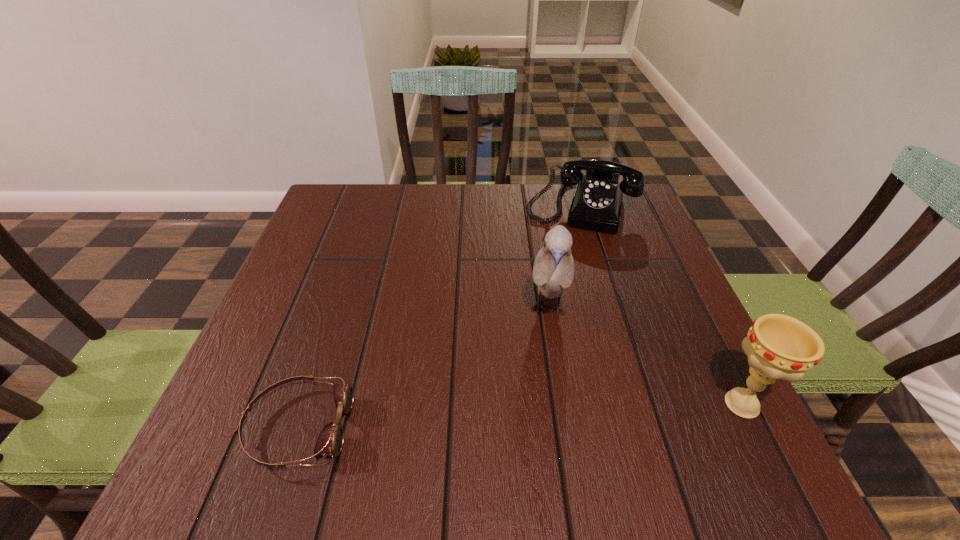
The height and width of the screenshot is (540, 960). What are the coordinates of `free region located at the beak of the tallest object` in the screenshot? It's located at (547, 379).

Where is `vacant space situated on the dial of the telephone`? The width and height of the screenshot is (960, 540). vacant space situated on the dial of the telephone is located at coordinates (557, 289).

Identify the location of free space located on the dial of the telephone. The image size is (960, 540). (563, 266).

Find the location of a particular element. This screenshot has width=960, height=540. vacant area situated on the dial of the telephone is located at coordinates (546, 328).

Image resolution: width=960 pixels, height=540 pixels. Identify the location of object located at the far edge. (597, 201).

At what (x,y) coordinates should I click in order to perform the action: click on goggles situated at the near edge. Please return your answer as a coordinate pair (x, y). Looking at the image, I should click on (330, 440).

Locate an element on the screen. chalice that is at the near edge is located at coordinates (778, 346).

What are the coordinates of `object that is at the left edge` in the screenshot? It's located at (330, 440).

Locate an element on the screen. chalice that is at the right edge is located at coordinates (778, 346).

Locate an element on the screen. telephone present at the right edge is located at coordinates (597, 201).